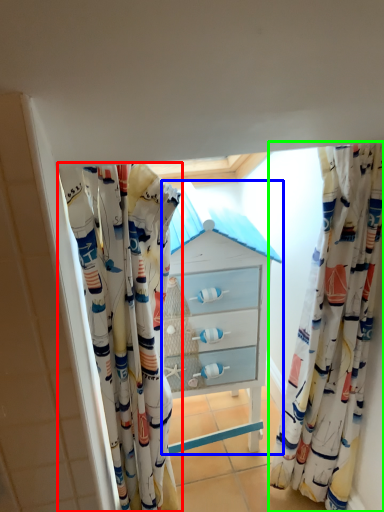
Question: Which object is the closest to the curtain (highlighted by a red box)? Choose among these: chest of drawers (highlighted by a blue box) or curtain (highlighted by a green box).

Choices:
 (A) chest of drawers
 (B) curtain

Answer: (A)